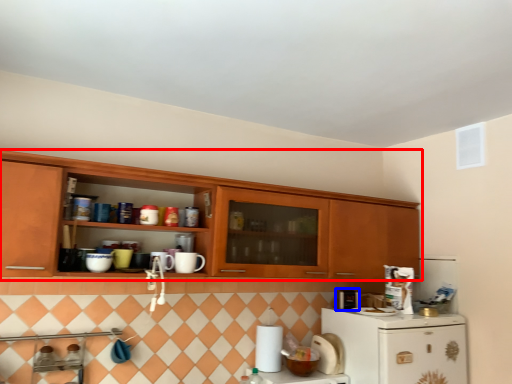
Question: Which object appears farthest to the camera in this image, cabinetry (highlighted by a red box) or appliance (highlighted by a blue box)?

Choices:
 (A) cabinetry
 (B) appliance

Answer: (B)